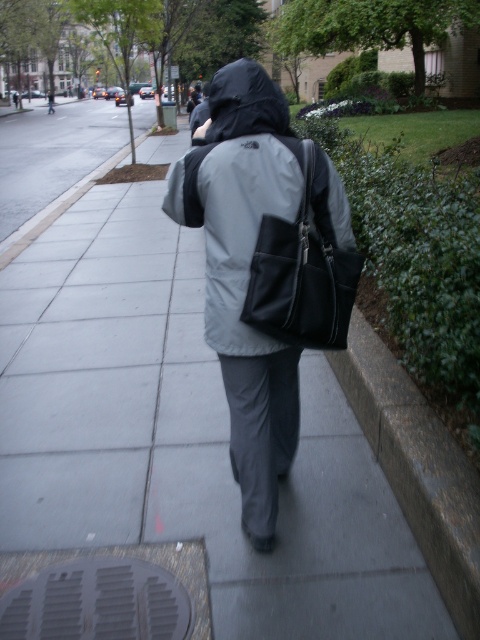
How far apart are black leather backpack at center and black matte hood at center?

black leather backpack at center is 67.77 centimeters away from black matte hood at center.

Between black leather backpack at center and black matte hood at center, which one appears on the left side from the viewer's perspective?

black matte hood at center is more to the left.

Who is more distant from viewer, (305, 248) or (277, 97)?

Positioned behind is point (277, 97).

This screenshot has height=640, width=480. I want to click on black leather backpack at center, so click(x=301, y=275).

Does gray matte jacket at center appear under gray metallic manhole cover at lower left?

Actually, gray matte jacket at center is above gray metallic manhole cover at lower left.

Is gray matte jacket at center wider than gray metallic manhole cover at lower left?

Yes.

The width and height of the screenshot is (480, 640). I want to click on gray matte jacket at center, so click(x=233, y=189).

Who is lower down, gray metallic manhole cover at lower left or black matte hood at center?

Positioned lower is gray metallic manhole cover at lower left.

Is gray metallic manhole cover at lower left to the left of black matte hood at center from the viewer's perspective?

Yes, gray metallic manhole cover at lower left is to the left of black matte hood at center.

Describe the element at coordinates (96, 602) in the screenshot. The image size is (480, 640). I see `gray metallic manhole cover at lower left` at that location.

The width and height of the screenshot is (480, 640). In order to click on gray metallic manhole cover at lower left in this screenshot , I will do `click(96, 602)`.